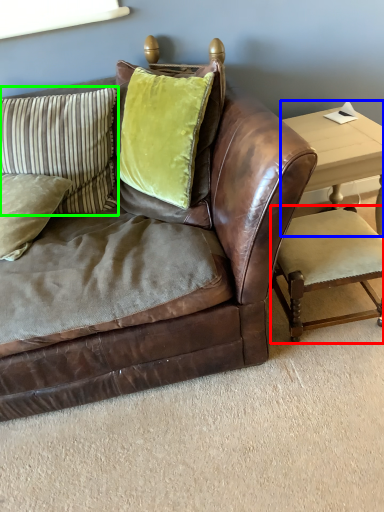
Question: Considering the real-world distances, which object is farthest from armchair (highlighted by a red box)? table (highlighted by a blue box) or pillow (highlighted by a green box)?

Choices:
 (A) table
 (B) pillow

Answer: (B)